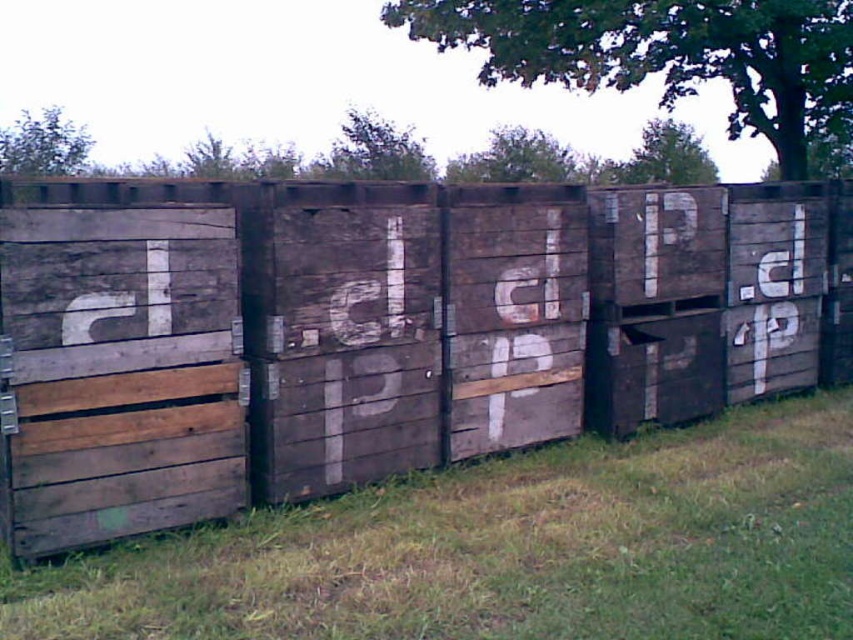
Question: Where is weathered wood crates at center located in relation to green grass at lower center in the image?

Choices:
 (A) left
 (B) right

Answer: (B)

Question: Observing the image, what is the correct spatial positioning of weathered wood crates at center in reference to green grass at lower center?

Choices:
 (A) below
 (B) above

Answer: (B)

Question: Does weathered wood crates at center have a greater width compared to green grass at lower center?

Choices:
 (A) no
 (B) yes

Answer: (A)

Question: Which of the following is the farthest from the observer?

Choices:
 (A) tap(780, 636)
 (B) tap(418, 448)

Answer: (B)